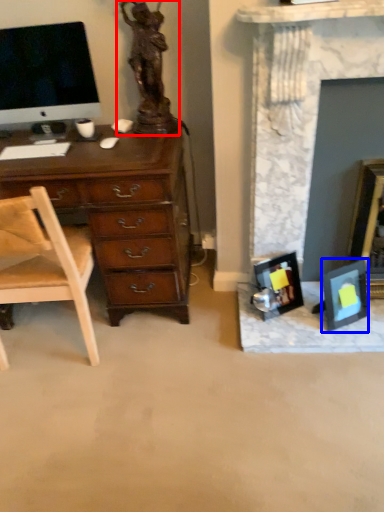
Question: Which object appears closest to the camera in this image, sculpture (highlighted by a red box) or picture frame (highlighted by a blue box)?

Choices:
 (A) sculpture
 (B) picture frame

Answer: (A)